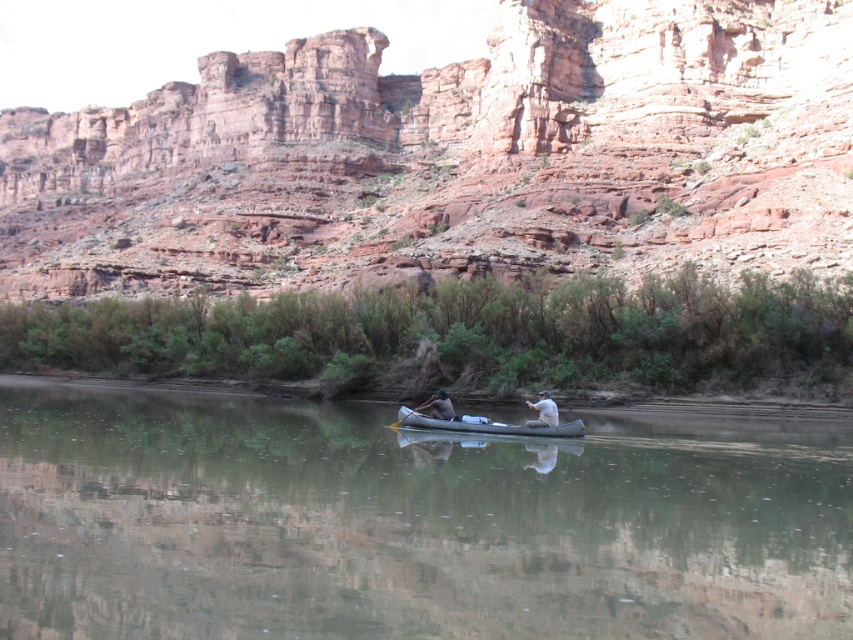
Between point (74, 403) and point (444, 392), which one is positioned behind?

The point (74, 403) is more distant.

Is clear water at center taller than matte gray kayak at center?

Indeed, clear water at center has a greater height compared to matte gray kayak at center.

Between point (68, 595) and point (439, 412), which one is positioned behind?

The point (439, 412) is behind.

Find the location of a particular element. The width and height of the screenshot is (853, 640). clear water at center is located at coordinates (410, 522).

Which is in front, point (561, 428) or point (428, 404)?

Point (561, 428)

Which of these two, gray rubber canoe at center or wooden paddle at center, stands shorter?

wooden paddle at center is shorter.

The image size is (853, 640). I want to click on gray rubber canoe at center, so click(474, 420).

Where is `gray rubber canoe at center`? This screenshot has width=853, height=640. gray rubber canoe at center is located at coordinates (474, 420).

Who is positioned more to the right, white cotton shirt at center or matte gray kayak at center?

white cotton shirt at center is more to the right.

Does point (548, 417) come in front of point (444, 408)?

Yes, it is in front of point (444, 408).

The image size is (853, 640). Identify the location of white cotton shirt at center. (543, 410).